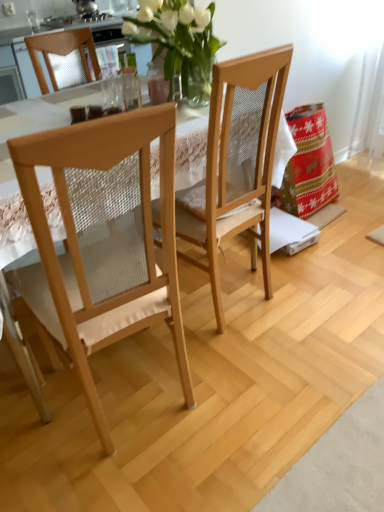
Question: Based on their positions, is light wood/mesh chair at left, the 2th chair when ordered from right to left, located to the left or right of light brown wood chair at center, which is the 2th chair from left to right?

Choices:
 (A) right
 (B) left

Answer: (B)

Question: From the image's perspective, is light wood/mesh chair at left, which is the 1th chair from left to right, positioned above or below light brown wood chair at center, which is the 2th chair from left to right?

Choices:
 (A) above
 (B) below

Answer: (B)

Question: Based on their sizes in the image, would you say light wood/mesh chair at left, the 2th chair when ordered from right to left, is bigger or smaller than light brown wood chair at center, which is the 2th chair from left to right?

Choices:
 (A) small
 (B) big

Answer: (B)

Question: From a real-world perspective, is light brown wood chair at center, which is the 2th chair from left to right, above or below light wood/mesh chair at left, the 2th chair when ordered from right to left?

Choices:
 (A) below
 (B) above

Answer: (B)

Question: In the image, is light brown wood chair at center, which is the 2th chair from left to right, positioned in front of or behind light wood/mesh chair at left, the 2th chair when ordered from right to left?

Choices:
 (A) behind
 (B) front

Answer: (A)

Question: From the image's perspective, is light brown wood chair at center, acting as the 1th chair starting from the right, positioned above or below light wood/mesh chair at left, which is the 1th chair from left to right?

Choices:
 (A) above
 (B) below

Answer: (A)

Question: Considering the positions of point (215, 71) and point (134, 234), is point (215, 71) closer or farther from the camera than point (134, 234)?

Choices:
 (A) farther
 (B) closer

Answer: (A)